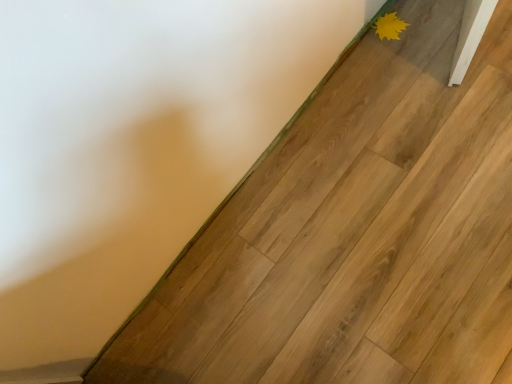
The image size is (512, 384). I want to click on free space in front of yellow matte maple leaf at upper right, so click(412, 61).